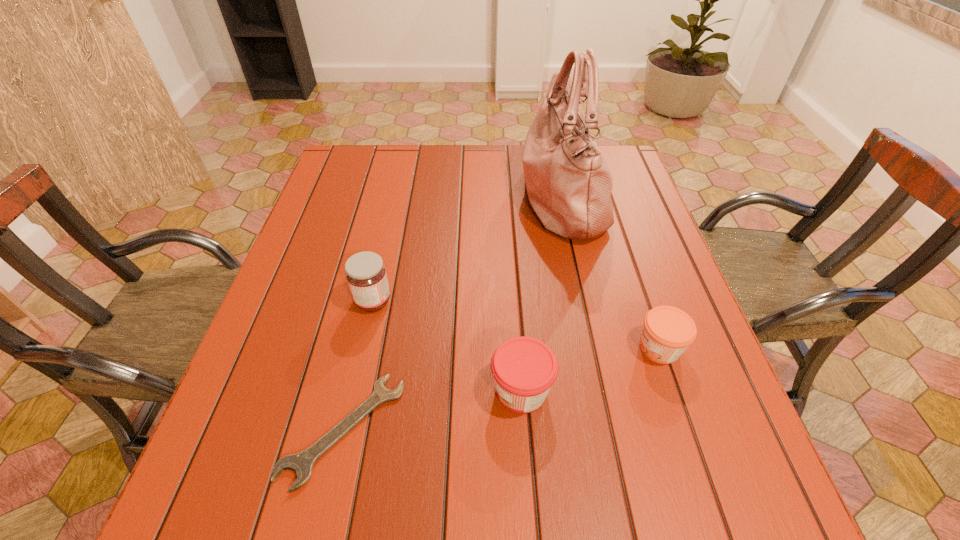
At what (x,y) coordinates should I click in order to perform the action: click on free spot between the fourth shortest object and the tallest object. Please return your answer as a coordinate pair (x, y). The width and height of the screenshot is (960, 540). Looking at the image, I should click on coord(468,249).

The image size is (960, 540). Find the location of `free space between the handbag and the shortest jam`. free space between the handbag and the shortest jam is located at coordinates (611, 273).

Find the location of a particular element. Image resolution: width=960 pixels, height=540 pixels. object identified as the second closest to the leftmost jam is located at coordinates (524, 369).

Locate an element on the screen. object that ranks as the closest to the tallest object is located at coordinates (667, 331).

At what (x,y) coordinates should I click in order to perform the action: click on jam that is the second nearest to the second shortest jam. Please return your answer as a coordinate pair (x, y). The height and width of the screenshot is (540, 960). Looking at the image, I should click on (366, 275).

Identify which jam is the second closest to the rightmost jam. Please provide its 2D coordinates. Your answer should be formatted as a tuple, i.e. [(x, y)], where the tuple contains the x and y coordinates of a point satisfying the conditions above.

[(366, 275)]